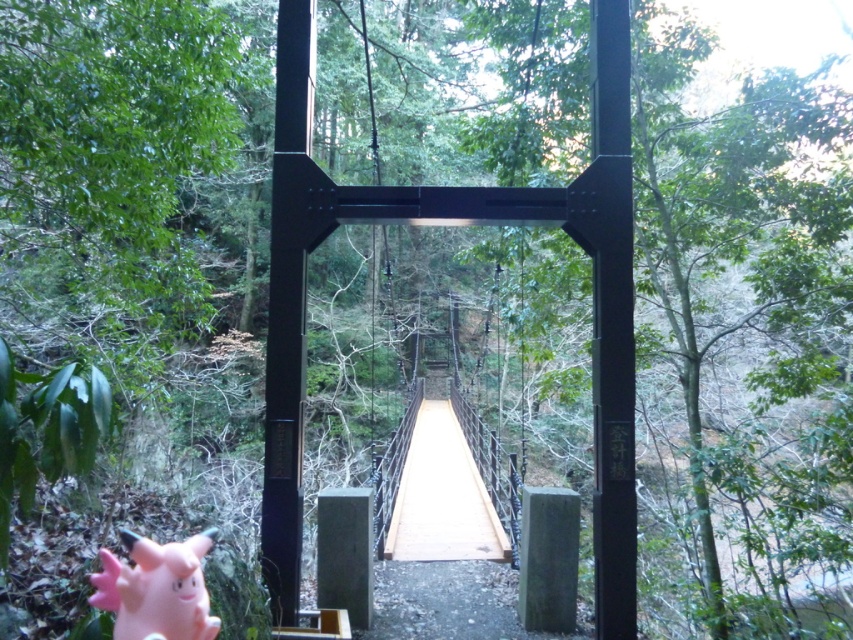
You are standing at the starting point of the forest path. You see a point marked at coordinates (467,221). What object is located at that point?

The point at coordinates (467,221) indicates the black metal suspension bridge at center.

In the scene shown: You are a hiker carrying a backpack weighing 30 pounds. You need to cross the gap between the black metal suspension bridge at center and the wooden bridge at center. Can you safely jump across the gap?

The distance between the black metal suspension bridge at center and wooden bridge at center is 20.63 feet, which is too wide for a safe jump while carrying a 30 pound backpack. You should find an alternative path or wait for assistance.

You are a hiker carrying a pink rubber toy at lower left. You want to cross the wooden bridge at center to reach the other side. Is the toy in a good position to safely step onto the bridge?

The wooden bridge at center is positioned under the pink rubber toy at lower left. This means the toy is above the bridge, so you can safely step onto the bridge without the toy obstructing your path.